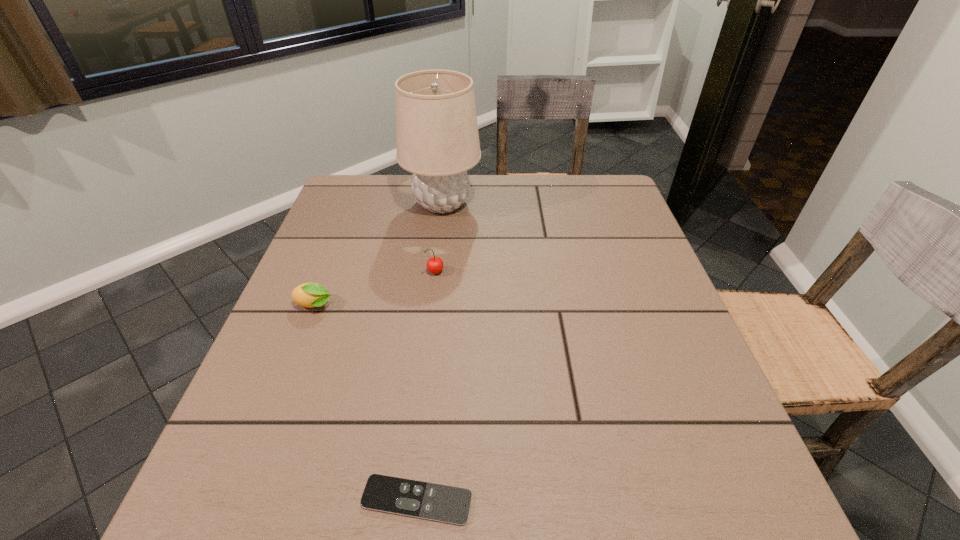
Locate an element on the screen. free point at the far right corner is located at coordinates (592, 219).

This screenshot has height=540, width=960. Identify the location of vacant space at the near right corner of the desktop. (649, 480).

Locate an element on the screen. The height and width of the screenshot is (540, 960). vacant space that is in between the second nearest object and the cherry is located at coordinates (375, 289).

Locate an element on the screen. The image size is (960, 540). vacant area that lies between the second farthest object and the nearest object is located at coordinates (426, 387).

Identify the location of vacant space that's between the third nearest object and the nearest object. The height and width of the screenshot is (540, 960). click(426, 387).

Identify the location of empty space that is in between the tallest object and the leftmost object. The height and width of the screenshot is (540, 960). (378, 254).

At what (x,y) coordinates should I click in order to perform the action: click on free spot between the tallest object and the cherry. Please return your answer as a coordinate pair (x, y). The height and width of the screenshot is (540, 960). Looking at the image, I should click on (439, 238).

The height and width of the screenshot is (540, 960). Find the location of `empty location between the lampshade and the third shortest object`. empty location between the lampshade and the third shortest object is located at coordinates (439, 238).

Identify the location of free point between the lampshade and the remote control. Image resolution: width=960 pixels, height=540 pixels. (429, 352).

Where is `free spot between the third nearest object and the nearest object`? This screenshot has height=540, width=960. free spot between the third nearest object and the nearest object is located at coordinates (426, 387).